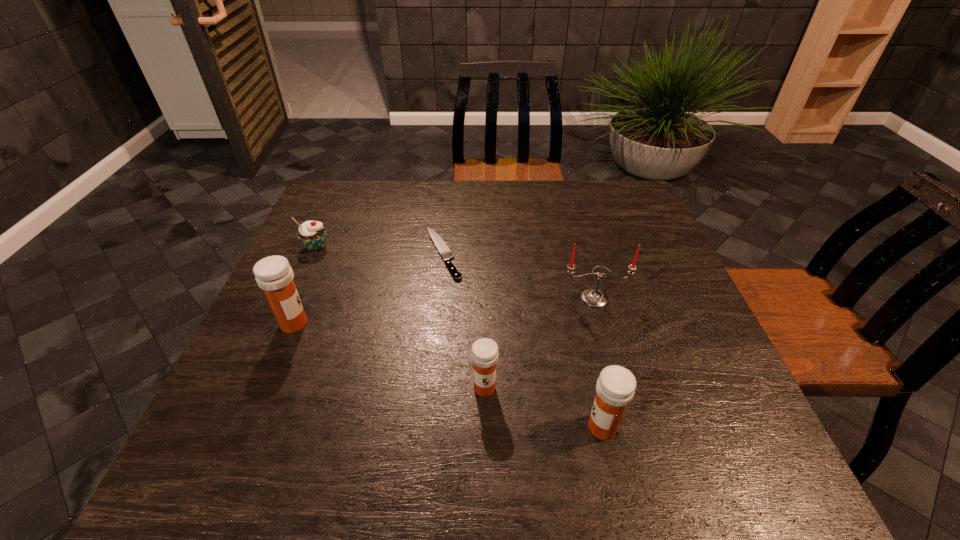
Where is `free location located 0.310m on the label side of the leftmost medicine`? The height and width of the screenshot is (540, 960). free location located 0.310m on the label side of the leftmost medicine is located at coordinates (444, 323).

Identify the location of vacant space located on the label side of the rightmost medicine. (371, 427).

At what (x,y) coordinates should I click in order to perform the action: click on free spot located on the label side of the rightmost medicine. Please return your answer as a coordinate pair (x, y). This screenshot has height=540, width=960. Looking at the image, I should click on (371, 427).

Where is `free region located 0.200m on the label side of the rightmost medicine`? The image size is (960, 540). free region located 0.200m on the label side of the rightmost medicine is located at coordinates pyautogui.click(x=478, y=427).

Find the location of a particular element. vacant space located on the front-facing side of the candle is located at coordinates (606, 340).

The image size is (960, 540). In order to click on vacant point located on the right of the cupcake in this screenshot , I will do (x=457, y=247).

Where is `vacant space located on the back of the steak knife`? This screenshot has height=540, width=960. vacant space located on the back of the steak knife is located at coordinates pyautogui.click(x=450, y=184).

I want to click on medicine that is at the left edge, so click(273, 274).

Where is `cupcake that is at the left edge`? The image size is (960, 540). cupcake that is at the left edge is located at coordinates (312, 234).

In order to click on object at the right edge in this screenshot , I will do `click(593, 297)`.